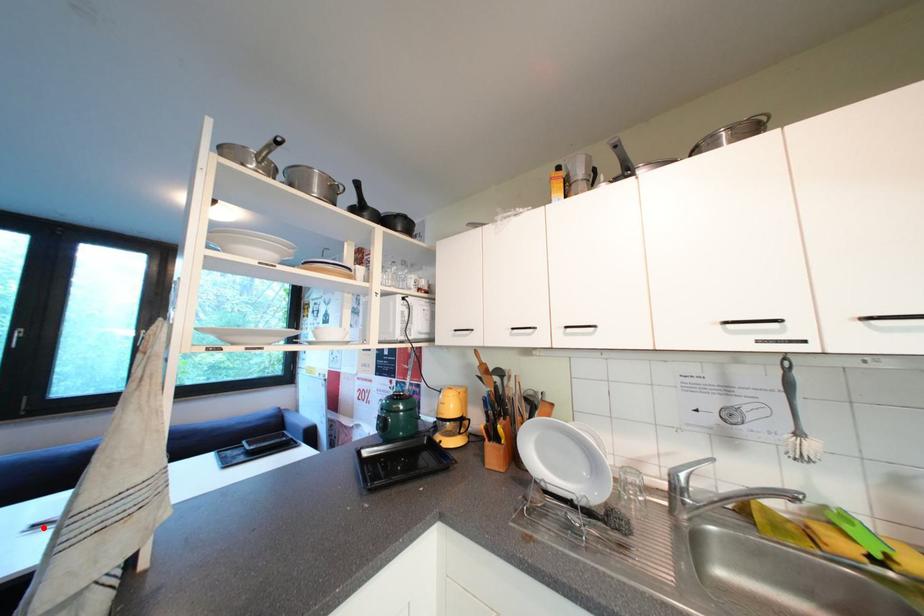
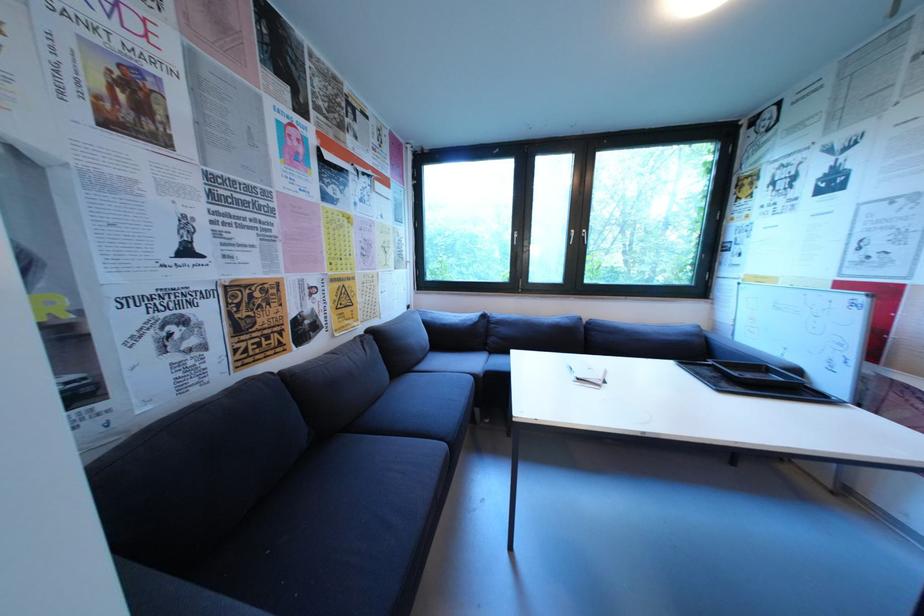
Find the pixel in the second image that matches the highlighted location in the first image.

(586, 381)